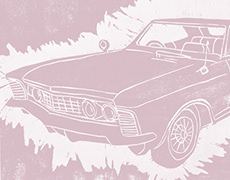
The height and width of the screenshot is (180, 230). I want to click on seat, so click(x=191, y=47), click(x=198, y=39).